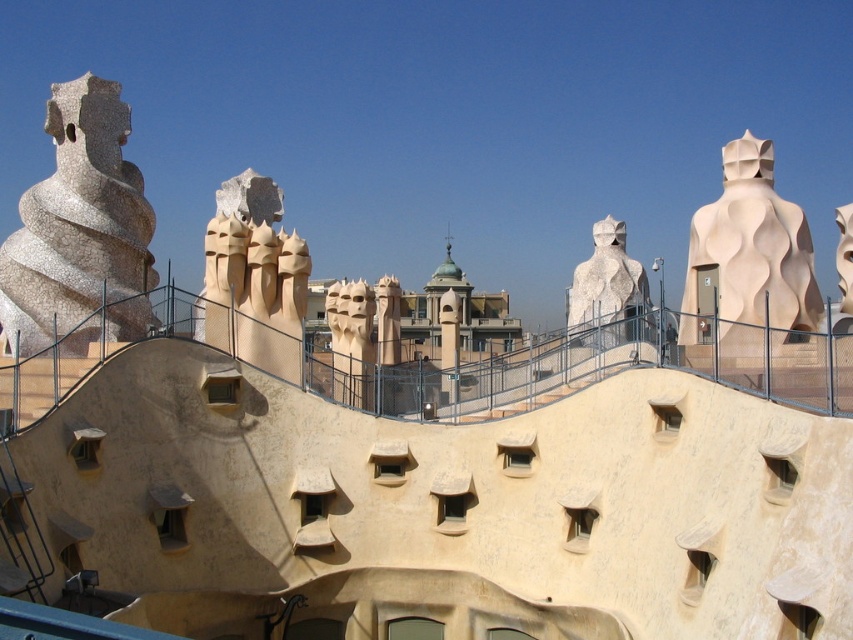
Question: Which object is positioned closest to the smooth beige chimneys at center?

Choices:
 (A) beige textured sculpture at right
 (B) beige stone face at center

Answer: (B)

Question: From the image, what is the correct spatial relationship of smooth beige chimneys at center in relation to beige stone face at center?

Choices:
 (A) below
 (B) above

Answer: (B)

Question: Does white mosaic sculpture at left appear over beige stone face at center?

Choices:
 (A) no
 (B) yes

Answer: (B)

Question: Estimate the real-world distances between objects in this image. Which object is farther from the beige stone face at center?

Choices:
 (A) smooth beige sculpture at upper right
 (B) smooth beige chimneys at center

Answer: (A)

Question: Considering the relative positions of beige stone face at center and smooth beige sculpture at upper right in the image provided, where is beige stone face at center located with respect to smooth beige sculpture at upper right?

Choices:
 (A) left
 (B) right

Answer: (A)

Question: Considering the real-world distances, which object is farthest from the smooth beige sculpture at upper right?

Choices:
 (A) beige textured sculpture at right
 (B) white textured sculpture at center
 (C) beige stone face at center
 (D) white mosaic sculpture at left

Answer: (D)